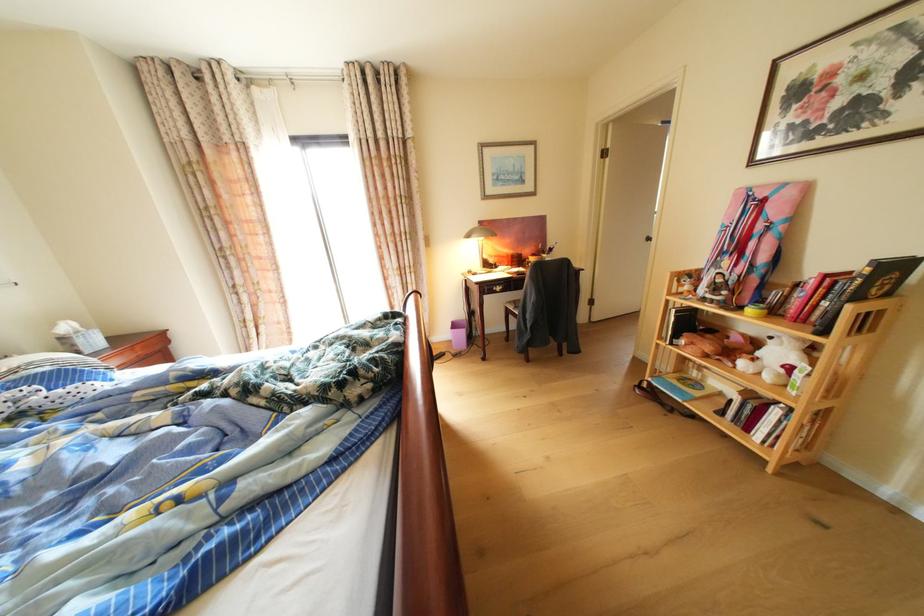
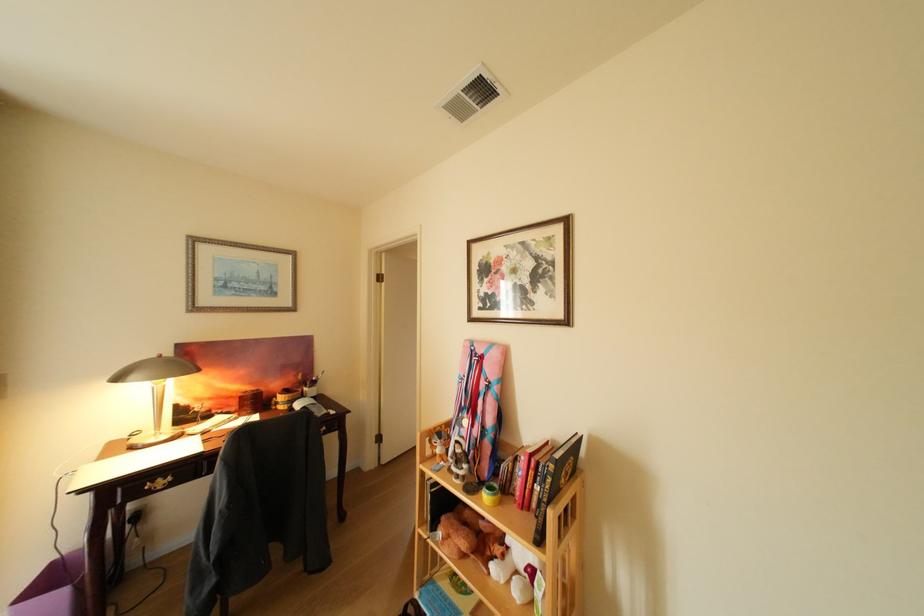
Locate, in the second image, the point that corresponds to (836,301) in the first image.

(548, 484)